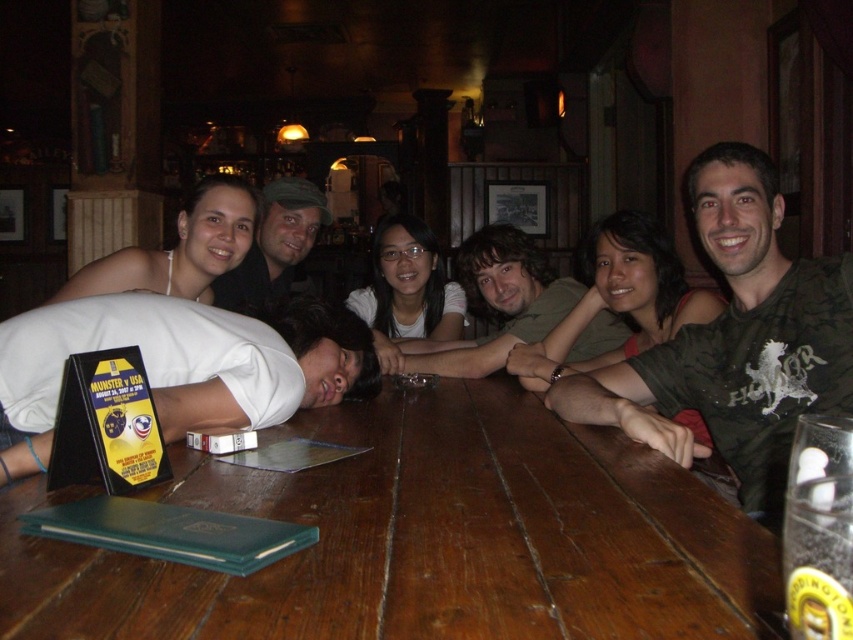
Question: Is dark brown hair at center below matte black shirt at center?

Choices:
 (A) no
 (B) yes

Answer: (B)

Question: Can you confirm if dark green t-shirt at center is bigger than dark brown hair at center?

Choices:
 (A) no
 (B) yes

Answer: (B)

Question: Which point appears closest to the camera in this image?

Choices:
 (A) (473, 304)
 (B) (215, 490)
 (C) (635, 416)

Answer: (B)

Question: Which object is the farthest from the dark green t-shirt at center?

Choices:
 (A) dark brown hair at center
 (B) matte black shirt at center
 (C) brown wooden table at center

Answer: (B)

Question: Which object appears closest to the camera in this image?

Choices:
 (A) dark brown hair at center
 (B) brown wooden table at center
 (C) dark green t-shirt at center
 (D) matte black shirt at center

Answer: (B)

Question: Can you confirm if brown wooden table at center is thinner than dark green t-shirt at center?

Choices:
 (A) no
 (B) yes

Answer: (A)